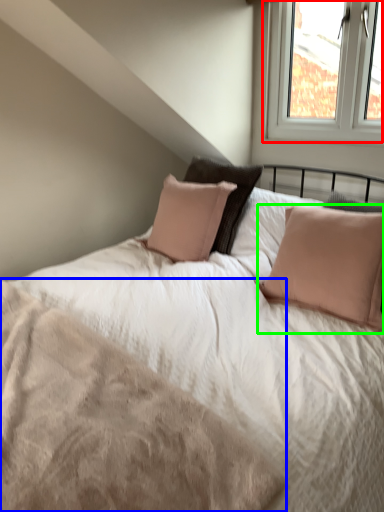
Question: Which object is positioned farthest from window (highlighted by a red box)? Select from mattress (highlighted by a blue box) and pillow (highlighted by a green box).

Choices:
 (A) mattress
 (B) pillow

Answer: (A)